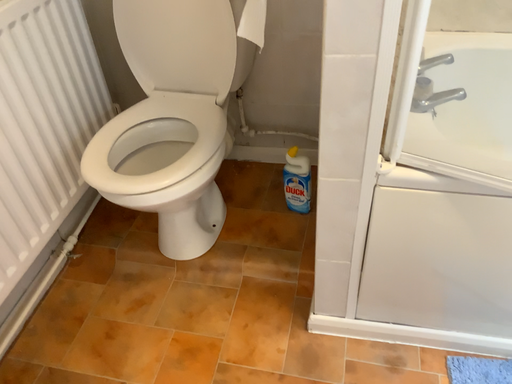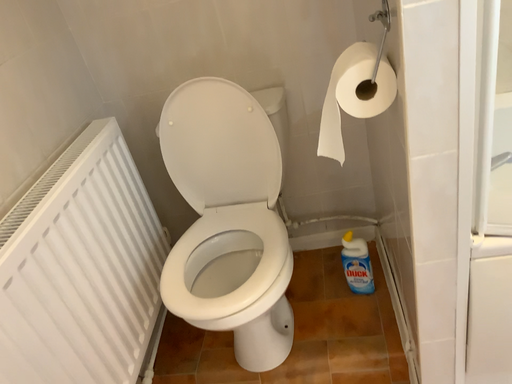
Question: How did the camera likely rotate when shooting the video?

Choices:
 (A) rotated upward
 (B) rotated downward

Answer: (A)